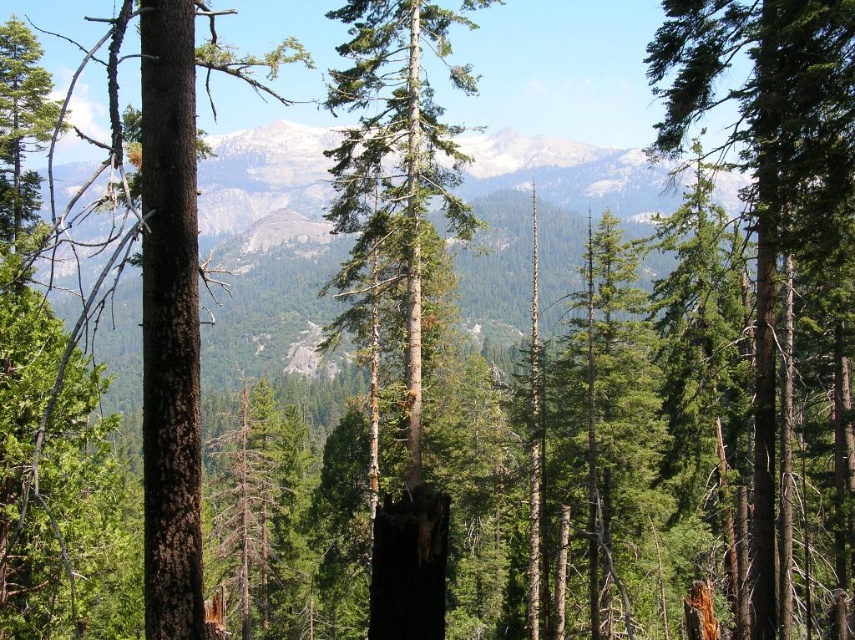
Does green rough bark tree at center appear on the right side of green matte tree at right?

Incorrect, green rough bark tree at center is not on the right side of green matte tree at right.

Where is `green rough bark tree at center`? This screenshot has height=640, width=855. green rough bark tree at center is located at coordinates (399, 269).

This screenshot has width=855, height=640. In order to click on green rough bark tree at center in this screenshot , I will do `click(399, 269)`.